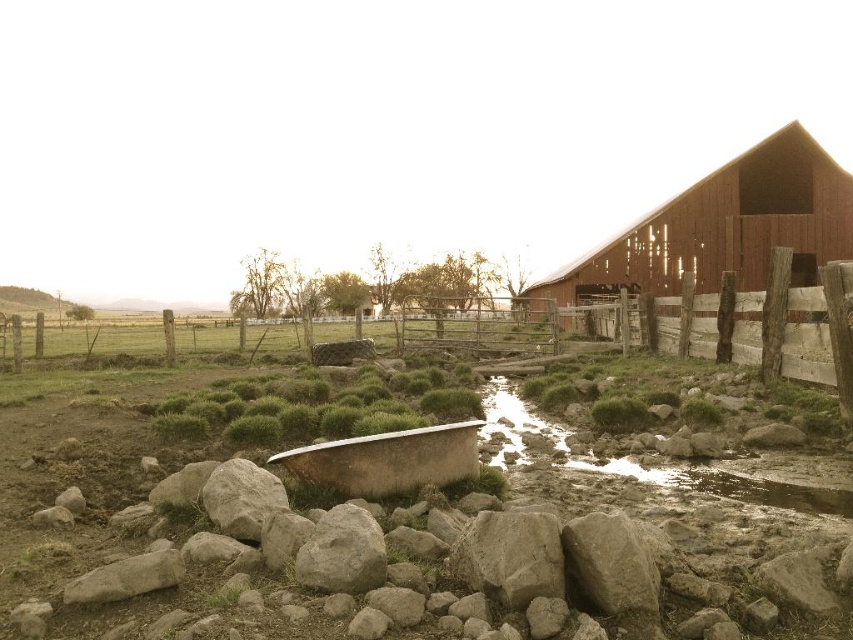
Question: Among these objects, which one is nearest to the camera?

Choices:
 (A) wooden fence at right
 (B) smooth wooden barn at upper right
 (C) muddy stone stream at center
 (D) rusty metal tub at center

Answer: (D)

Question: In this image, where is wooden fence at right located relative to gray rough rock at center?

Choices:
 (A) left
 (B) right

Answer: (B)

Question: Is rusty metal tub at center below gray rough rock at center?

Choices:
 (A) yes
 (B) no

Answer: (B)

Question: Is smooth wooden barn at upper right behind muddy stone stream at center?

Choices:
 (A) no
 (B) yes

Answer: (B)

Question: Which of these objects is positioned closest to the wooden fence at right?

Choices:
 (A) muddy stone stream at center
 (B) rusty metal tub at center

Answer: (A)

Question: Which point is closer to the camera taking this photo?

Choices:
 (A) (529, 448)
 (B) (339, 520)
 (C) (836, 198)
 (D) (431, 433)

Answer: (B)